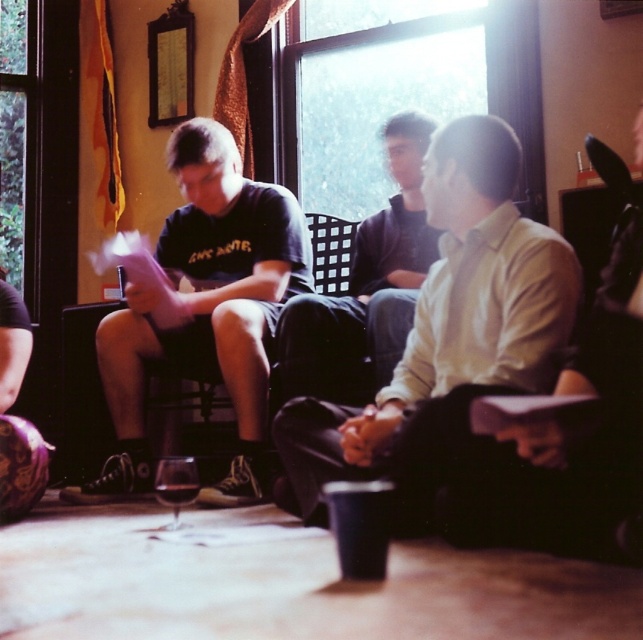
Question: Observing the image, what is the correct spatial positioning of dark gray shirt at center in reference to transparent glass at lower center?

Choices:
 (A) below
 (B) above

Answer: (B)

Question: Which object is the closest to the dark gray shirt at center?

Choices:
 (A) translucent glass wine at lower center
 (B) light beige shirt at center
 (C) matte black t-shirt at center
 (D) transparent glass at lower center

Answer: (C)

Question: Does matte black t-shirt at center have a lesser width compared to dark gray shirt at center?

Choices:
 (A) yes
 (B) no

Answer: (B)

Question: Based on their relative distances, which object is farther from the transparent glass at lower center?

Choices:
 (A) light beige shirt at center
 (B) translucent glass wine at lower center
 (C) dark gray shirt at center

Answer: (C)

Question: Does matte black t-shirt at center appear under translucent glass wine at lower center?

Choices:
 (A) yes
 (B) no

Answer: (B)

Question: Which point is farther to the camera?

Choices:
 (A) transparent glass at lower center
 (B) matte black t-shirt at center
 (C) dark gray shirt at center

Answer: (B)